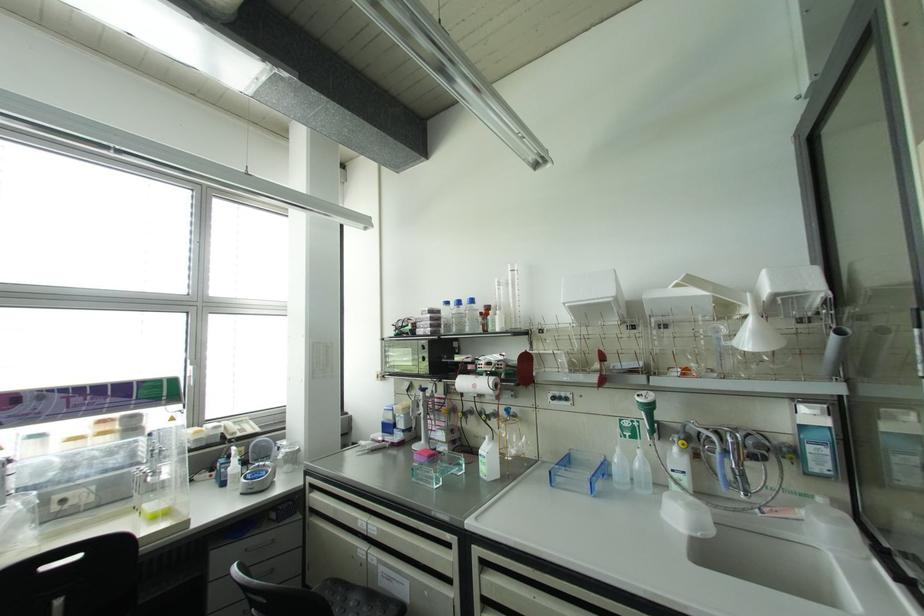
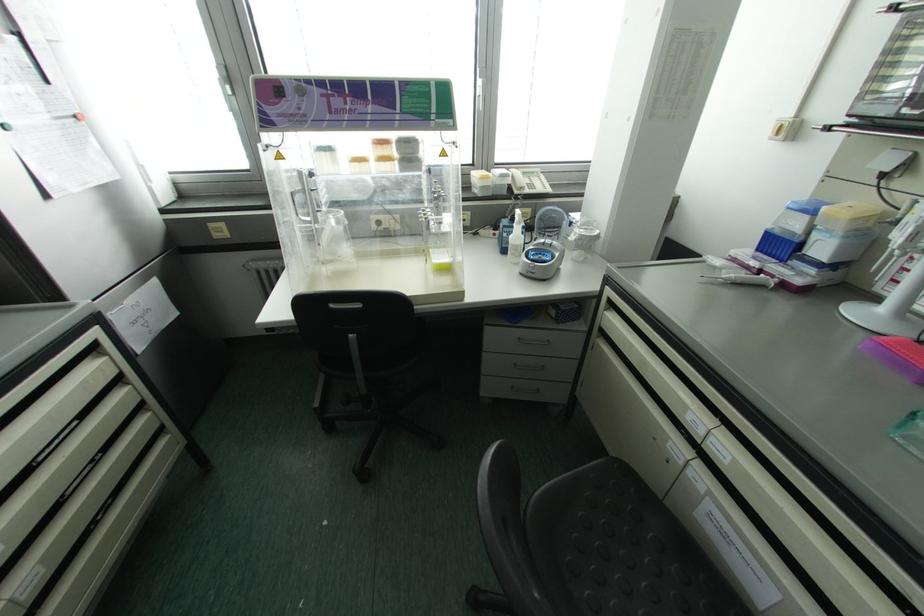
Find the pixel in the second image that matches point 108,440 in the first image.

(393, 169)